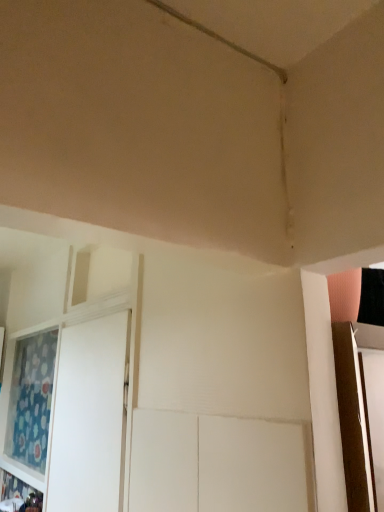
Question: Does white glossy screen door at left have a lesser width compared to blue floral fabric curtain at left?

Choices:
 (A) no
 (B) yes

Answer: (A)

Question: From a real-world perspective, is white glossy screen door at left below blue floral fabric curtain at left?

Choices:
 (A) no
 (B) yes

Answer: (B)

Question: Is white glossy screen door at left far away from blue floral fabric curtain at left?

Choices:
 (A) yes
 (B) no

Answer: (B)

Question: Is the position of white glossy screen door at left more distant than that of blue floral fabric curtain at left?

Choices:
 (A) no
 (B) yes

Answer: (A)

Question: Would you say white glossy screen door at left contains blue floral fabric curtain at left?

Choices:
 (A) no
 (B) yes

Answer: (A)

Question: Considering the relative sizes of white glossy screen door at left and blue floral fabric curtain at left in the image provided, is white glossy screen door at left shorter than blue floral fabric curtain at left?

Choices:
 (A) yes
 (B) no

Answer: (B)

Question: Is the position of blue floral fabric curtain at left less distant than that of white glossy screen door at left?

Choices:
 (A) yes
 (B) no

Answer: (B)

Question: From a real-world perspective, does blue floral fabric curtain at left stand above white glossy screen door at left?

Choices:
 (A) no
 (B) yes

Answer: (B)

Question: From the image's perspective, is blue floral fabric curtain at left over white glossy screen door at left?

Choices:
 (A) yes
 (B) no

Answer: (B)

Question: Does blue floral fabric curtain at left have a greater height compared to white glossy screen door at left?

Choices:
 (A) no
 (B) yes

Answer: (A)

Question: Does blue floral fabric curtain at left have a lesser width compared to white glossy screen door at left?

Choices:
 (A) yes
 (B) no

Answer: (A)

Question: Can you confirm if blue floral fabric curtain at left is bigger than white glossy screen door at left?

Choices:
 (A) yes
 (B) no

Answer: (A)

Question: From a real-world perspective, is white glossy screen door at left positioned above or below blue floral fabric curtain at left?

Choices:
 (A) above
 (B) below

Answer: (B)